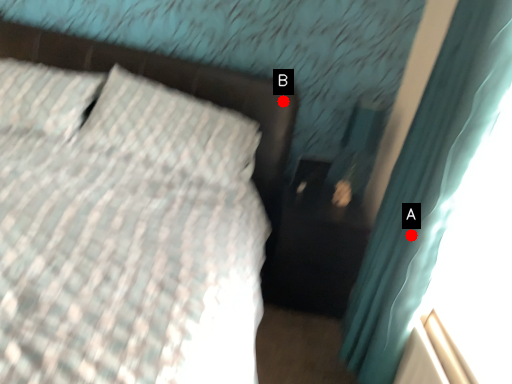
Question: Two points are circled on the image, labeled by A and B beside each circle. Which point appears closest to the camera in this image?

Choices:
 (A) A is closer
 (B) B is closer

Answer: (A)